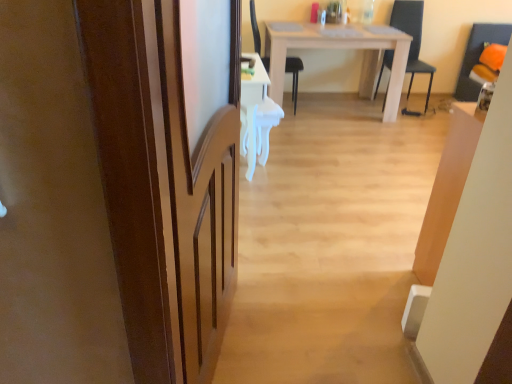
Question: Is black plastic chair at center, the first chair in the left-to-right sequence, to the right of brown wooden screen door at left from the viewer's perspective?

Choices:
 (A) yes
 (B) no

Answer: (A)

Question: Can you confirm if black plastic chair at center, which is the 2th chair in right-to-left order, is thinner than brown wooden screen door at left?

Choices:
 (A) yes
 (B) no

Answer: (B)

Question: From the image's perspective, would you say black plastic chair at center, the first chair in the left-to-right sequence, is positioned over brown wooden screen door at left?

Choices:
 (A) yes
 (B) no

Answer: (A)

Question: Is black plastic chair at center, the first chair in the left-to-right sequence, aimed at brown wooden screen door at left?

Choices:
 (A) no
 (B) yes

Answer: (A)

Question: Would you say black plastic chair at center, the first chair in the left-to-right sequence, is outside brown wooden screen door at left?

Choices:
 (A) no
 (B) yes

Answer: (B)

Question: Is black plastic chair at center, the first chair in the left-to-right sequence, wider or thinner than white matte table at center?

Choices:
 (A) wide
 (B) thin

Answer: (B)

Question: Is black plastic chair at center, which is the 2th chair in right-to-left order, inside the boundaries of white matte table at center, or outside?

Choices:
 (A) inside
 (B) outside

Answer: (A)

Question: Is black plastic chair at center, the first chair in the left-to-right sequence, to the left or to the right of white matte table at center in the image?

Choices:
 (A) right
 (B) left

Answer: (B)

Question: In terms of height, does black plastic chair at center, which is the 2th chair in right-to-left order, look taller or shorter compared to white matte table at center?

Choices:
 (A) short
 (B) tall

Answer: (B)

Question: In the image, is black plastic chair at center, the first chair in the left-to-right sequence, on the left side or the right side of brown wooden screen door at left?

Choices:
 (A) left
 (B) right

Answer: (B)

Question: In terms of height, does black plastic chair at center, the first chair in the left-to-right sequence, look taller or shorter compared to brown wooden screen door at left?

Choices:
 (A) short
 (B) tall

Answer: (A)

Question: Do you think black plastic chair at center, which is the 2th chair in right-to-left order, is within brown wooden screen door at left, or outside of it?

Choices:
 (A) outside
 (B) inside

Answer: (A)

Question: Looking at their shapes, would you say black plastic chair at center, which is the 2th chair in right-to-left order, is wider or thinner than brown wooden screen door at left?

Choices:
 (A) thin
 (B) wide

Answer: (B)

Question: In terms of width, does brown wooden screen door at left look wider or thinner when compared to white glossy desk at center?

Choices:
 (A) wide
 (B) thin

Answer: (B)

Question: Looking at the image, does brown wooden screen door at left seem bigger or smaller compared to white glossy desk at center?

Choices:
 (A) big
 (B) small

Answer: (A)